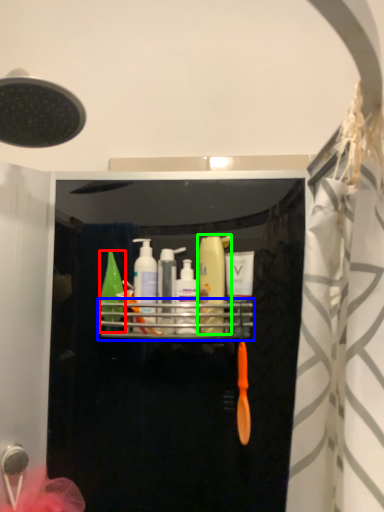
Question: Estimate the real-world distances between objects in this image. Which object is farther from mouthwash (highlighted by a red box), shelf (highlighted by a blue box) or mouthwash (highlighted by a green box)?

Choices:
 (A) shelf
 (B) mouthwash

Answer: (B)